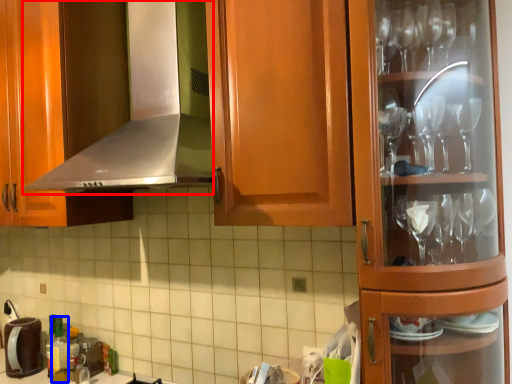
Question: Which of the following is the farthest to the observer, exhaust hood (highlighted by a red box) or bottle (highlighted by a blue box)?

Choices:
 (A) exhaust hood
 (B) bottle

Answer: (B)